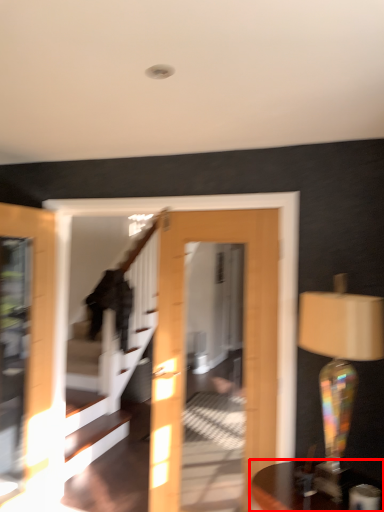
Question: From the image's perspective, where is table (annotated by the red box) located in relation to table lamp in the image?

Choices:
 (A) above
 (B) below

Answer: (B)